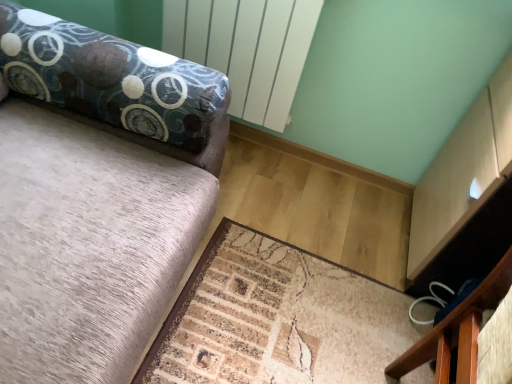
Locate an element on the screen. Image resolution: width=512 pixels, height=384 pixels. vacant area on top of beige textured mat at lower center (from a real-world perspective) is located at coordinates (309, 264).